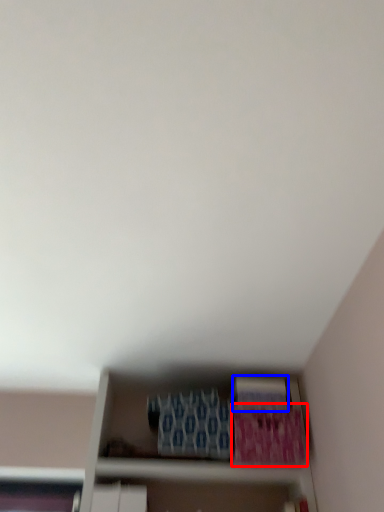
Question: Which point is further to the camera, paperback book (highlighted by a red box) or paperback book (highlighted by a blue box)?

Choices:
 (A) paperback book
 (B) paperback book

Answer: (B)